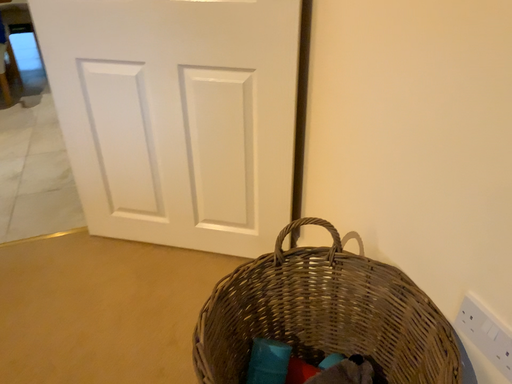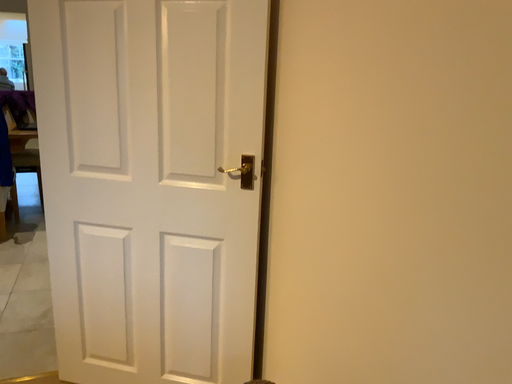
Question: How did the camera likely rotate when shooting the video?

Choices:
 (A) rotated downward
 (B) rotated upward

Answer: (B)